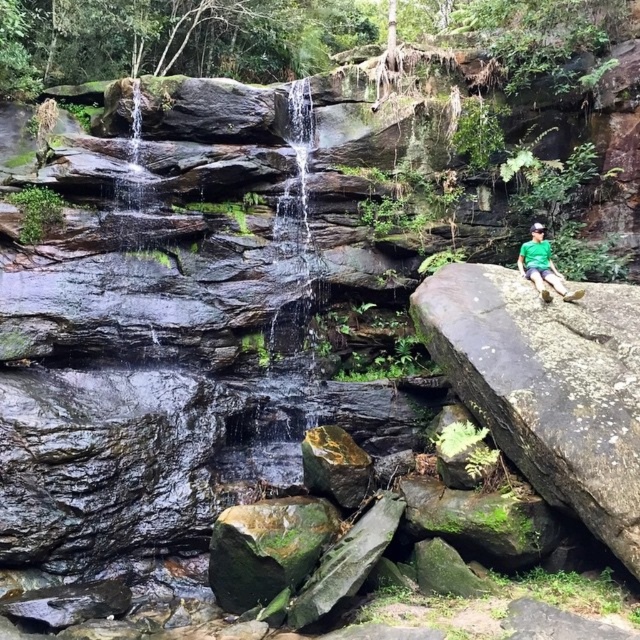
Question: Is green mossy rock at right wider than green fabric shirt at right?

Choices:
 (A) yes
 (B) no

Answer: (A)

Question: Which point is closer to the camera?

Choices:
 (A) (580, 401)
 (B) (538, 278)

Answer: (A)

Question: Which of the following is the closest to the observer?

Choices:
 (A) green mossy rock at right
 (B) green fabric shirt at right

Answer: (A)

Question: Is green mossy rock at right thinner than green fabric shirt at right?

Choices:
 (A) no
 (B) yes

Answer: (A)

Question: Which point appears closest to the camera in this image?

Choices:
 (A) (528, 266)
 (B) (513, 348)

Answer: (B)

Question: Does green mossy rock at right have a greater width compared to green fabric shirt at right?

Choices:
 (A) yes
 (B) no

Answer: (A)